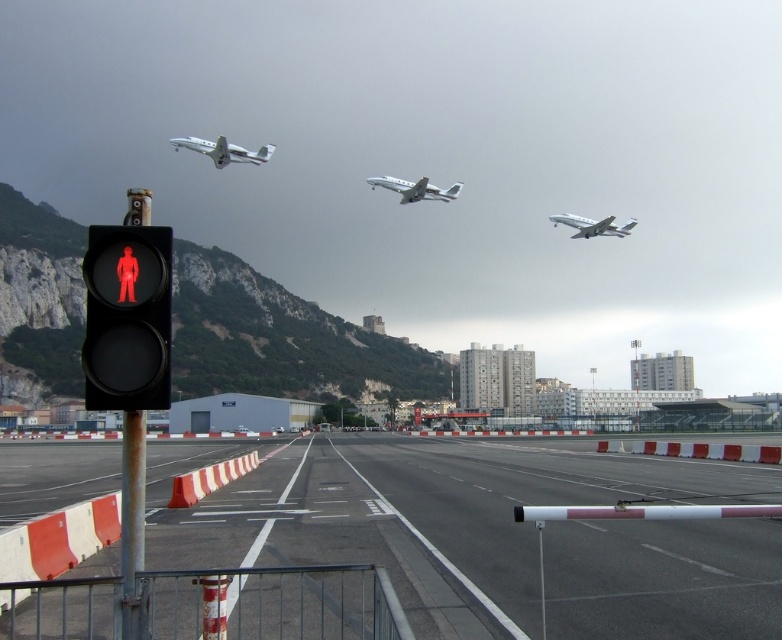
You are a pilot preparing to board the white glossy airplane at upper left and need to cross the runway. There is a black matte pedestrian signal at left showing a red figure. Should you cross the runway now?

The black matte pedestrian signal at left shows a red figure, indicating pedestrians should not cross. Therefore, you should not cross the runway now.

You are a maintenance worker tasked with measuring the width of the black matte pedestrian signal at left and the white glossy airplane at upper left. Based on the scene, which object has a greater width?

The white glossy airplane at upper left has a greater width than the black matte pedestrian signal at left.